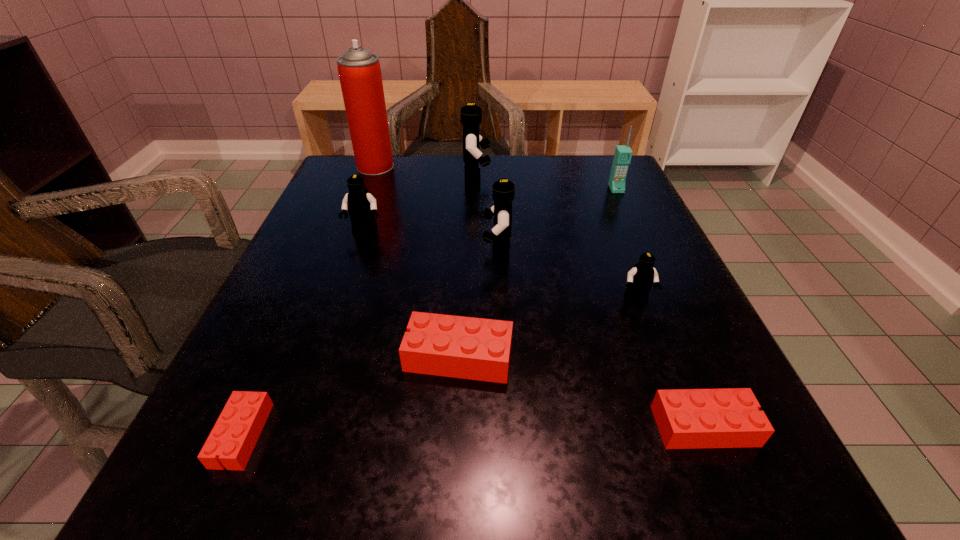
You are a GUI agent. You are given a task and a screenshot of the screen. Output one action in this format:
    pyautogui.click(x=<x>, y=<y>)
    Task: Click on the third shortest object
    
    Given the screenshot: What is the action you would take?
    (x=462, y=347)

This screenshot has height=540, width=960. Find the location of `the third nearest object`. the third nearest object is located at coordinates (462, 347).

At what (x,y) coordinates should I click in order to perform the action: click on the second shortest object. Please return your answer as a coordinate pair (x, y). The height and width of the screenshot is (540, 960). Looking at the image, I should click on click(686, 418).

At what (x,y) coordinates should I click in order to perform the action: click on the rightmost red Lego. Please return your answer as a coordinate pair (x, y). Looking at the image, I should click on (686, 418).

Identify the location of the leftmost Lego. The image size is (960, 540). (234, 436).

Locate an element on the screen. The height and width of the screenshot is (540, 960). the smallest red Lego is located at coordinates (234, 436).

Identify the location of vacant space located 0.200m on the right of the aerosol can. (474, 167).

The width and height of the screenshot is (960, 540). In order to click on vacant space located on the front-facing side of the farthest Lego in this screenshot , I will do `click(553, 180)`.

Identify the location of free region located 0.210m on the front-facing side of the third smallest black Lego. (372, 251).

This screenshot has height=540, width=960. Identify the location of blank space located on the front-facing side of the third smallest black Lego. (398, 251).